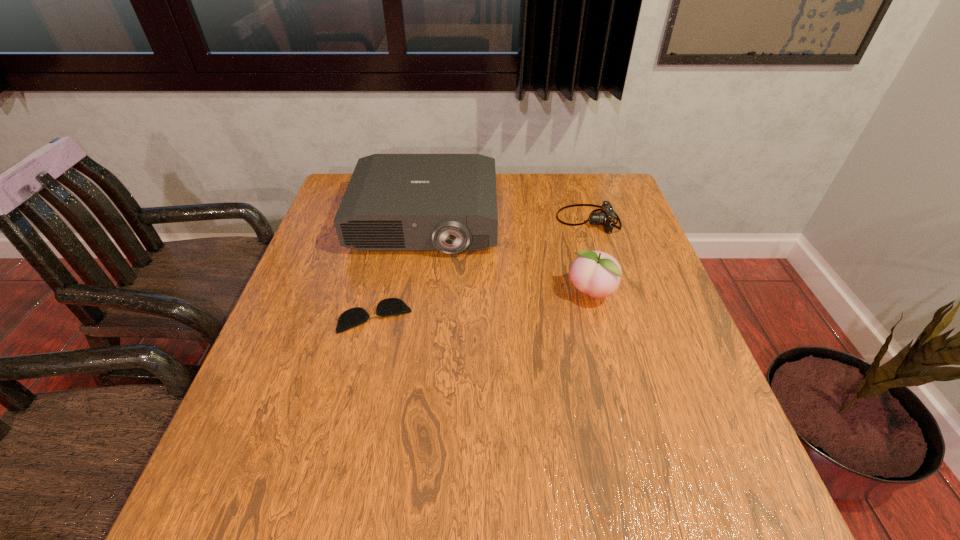
This screenshot has width=960, height=540. I want to click on vacant region at the left edge of the desktop, so click(x=307, y=271).

The height and width of the screenshot is (540, 960). I want to click on vacant space at the right edge, so click(x=619, y=217).

The height and width of the screenshot is (540, 960). Find the location of `vacant area at the far right corner of the desktop`. vacant area at the far right corner of the desktop is located at coordinates (625, 211).

Locate an element on the screen. This screenshot has height=540, width=960. free space that is in between the shortest object and the camera is located at coordinates (482, 268).

At what (x,y) coordinates should I click in order to perform the action: click on free space between the peach and the projector. Please return your answer as a coordinate pair (x, y). The width and height of the screenshot is (960, 540). Looking at the image, I should click on (508, 258).

What are the coordinates of `unoccupied area between the camera and the spectacles` in the screenshot? It's located at (482, 268).

I want to click on unoccupied position between the peach and the shortest object, so click(x=483, y=306).

Locate an element on the screen. vacant area that lies between the shortest object and the peach is located at coordinates (483, 306).

This screenshot has height=540, width=960. I want to click on free spot between the peach and the projector, so click(508, 258).

At what (x,y) coordinates should I click in order to perform the action: click on free area in between the peach and the projector. Please return your answer as a coordinate pair (x, y). This screenshot has height=540, width=960. Looking at the image, I should click on (508, 258).